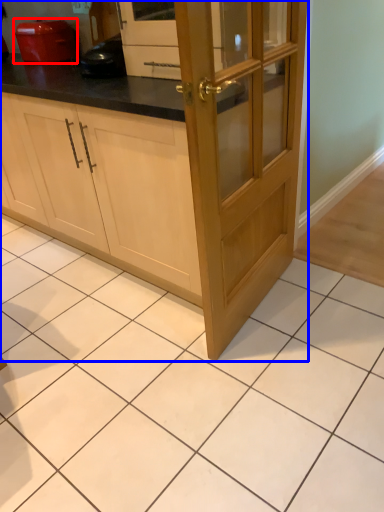
Question: Which object is closer to the camera taking this photo, home appliance (highlighted by a red box) or cabinetry (highlighted by a blue box)?

Choices:
 (A) home appliance
 (B) cabinetry

Answer: (B)